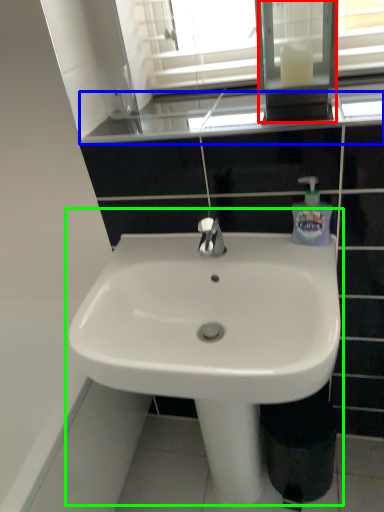
Question: Considering the real-world distances, which object is farthest from medicine cabinet (highlighted by a red box)? window sill (highlighted by a blue box) or sink (highlighted by a green box)?

Choices:
 (A) window sill
 (B) sink

Answer: (B)